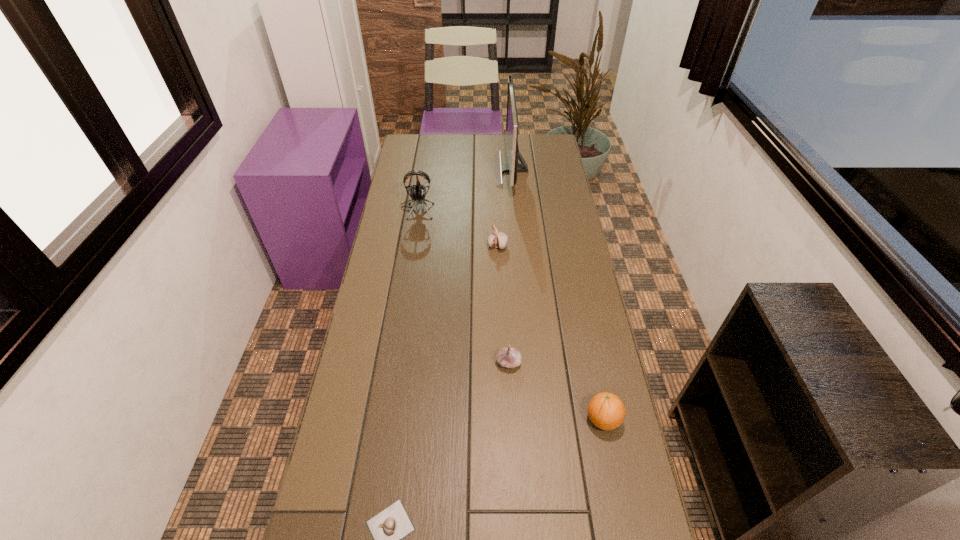
Identify the location of the tallest object. (512, 123).

This screenshot has height=540, width=960. I want to click on earphone, so click(x=418, y=192).

Identify the location of the third farthest object. (497, 239).

Where is `the fifth farthest object`? Image resolution: width=960 pixels, height=540 pixels. the fifth farthest object is located at coordinates (606, 411).

Where is `orange`? orange is located at coordinates (606, 411).

Where is `the second nearest garlic`? the second nearest garlic is located at coordinates (509, 357).

Identify the location of vacant space located 0.350m on the screen side of the tallest object. (418, 170).

At what (x,y) coordinates should I click in order to perform the action: click on vacant space positioned 0.400m on the screen side of the tallest object. Please return your answer as a coordinate pair (x, y). The height and width of the screenshot is (540, 960). Looking at the image, I should click on (406, 170).

At what (x,y) coordinates should I click in order to perform the action: click on vacant space situated on the screen side of the tallest object. Please return your answer as a coordinate pair (x, y). Looking at the image, I should click on (478, 170).

Where is `free spot located 0.210m on the back of the earphone`? Image resolution: width=960 pixels, height=540 pixels. free spot located 0.210m on the back of the earphone is located at coordinates (423, 171).